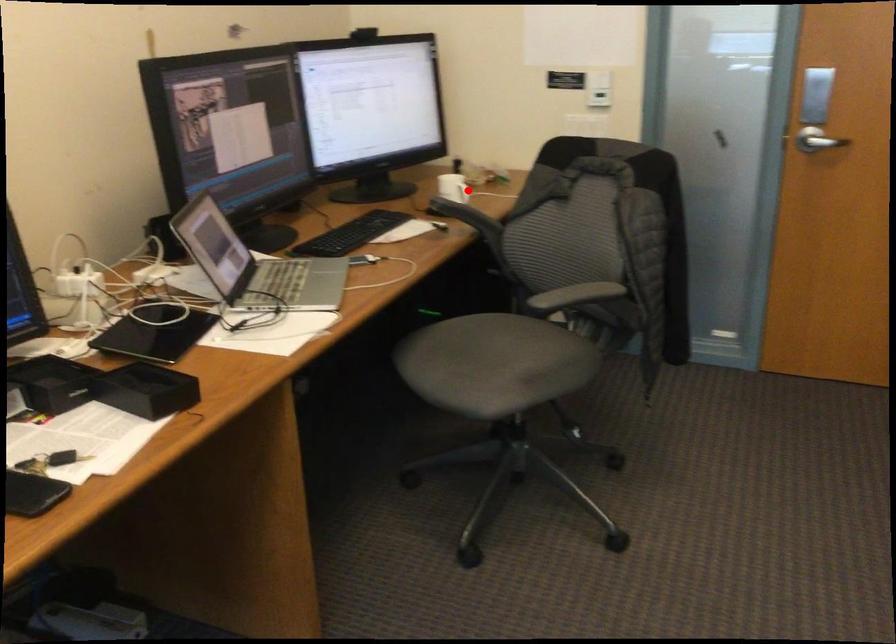
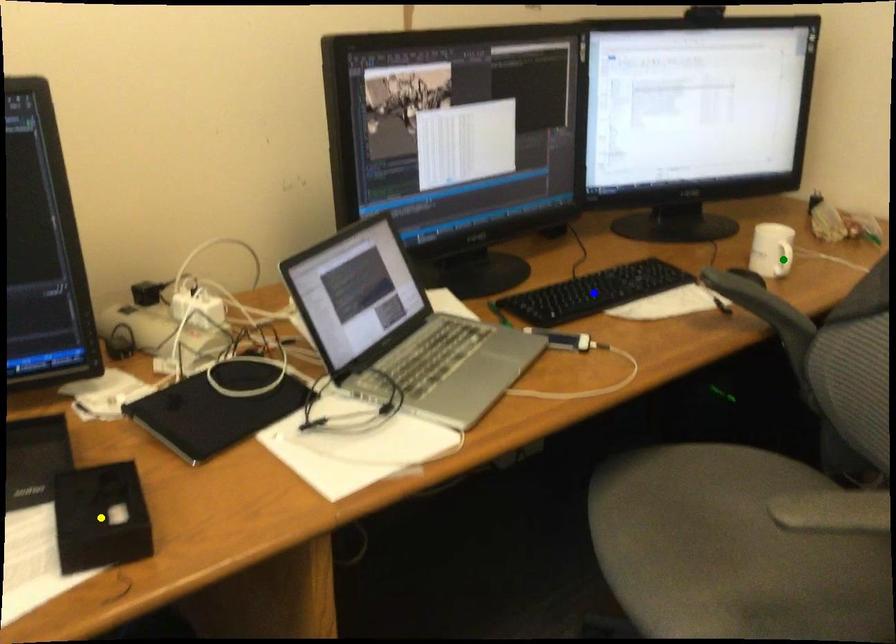
Question: I am providing you with two images of the same scene from different viewpoints. A red point is marked on the first image. You are given multiple points on the second image. Which point in image 2 is actually the same real-world point as the red point in image 1?

Choices:
 (A) blue point
 (B) yellow point
 (C) green point

Answer: (C)